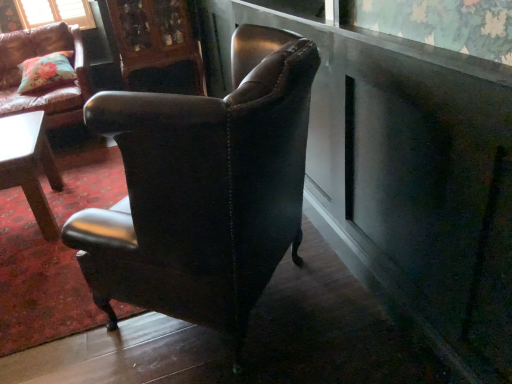
Question: In the image, is leather cushioned armchair at upper left, which ranks as the 1th chair in left-to-right order, positioned in front of or behind wooden carved cabinet at upper center?

Choices:
 (A) front
 (B) behind

Answer: (A)

Question: In terms of height, does leather cushioned armchair at upper left, marked as the second chair in a front-to-back arrangement, look taller or shorter compared to wooden carved cabinet at upper center?

Choices:
 (A) tall
 (B) short

Answer: (B)

Question: Which of these objects is positioned farthest from the matte brown leather chair at center, the first chair positioned from the front?

Choices:
 (A) floral fabric pillow at upper left
 (B) leather cushioned armchair at upper left, marked as the second chair in a front-to-back arrangement
 (C) wooden carved cabinet at upper center

Answer: (C)

Question: Estimate the real-world distances between objects in this image. Which object is farther from the wooden carved cabinet at upper center?

Choices:
 (A) leather cushioned armchair at upper left, which ranks as the 1th chair in left-to-right order
 (B) matte brown leather chair at center, acting as the 1th chair starting from the right
 (C) floral fabric pillow at upper left

Answer: (B)